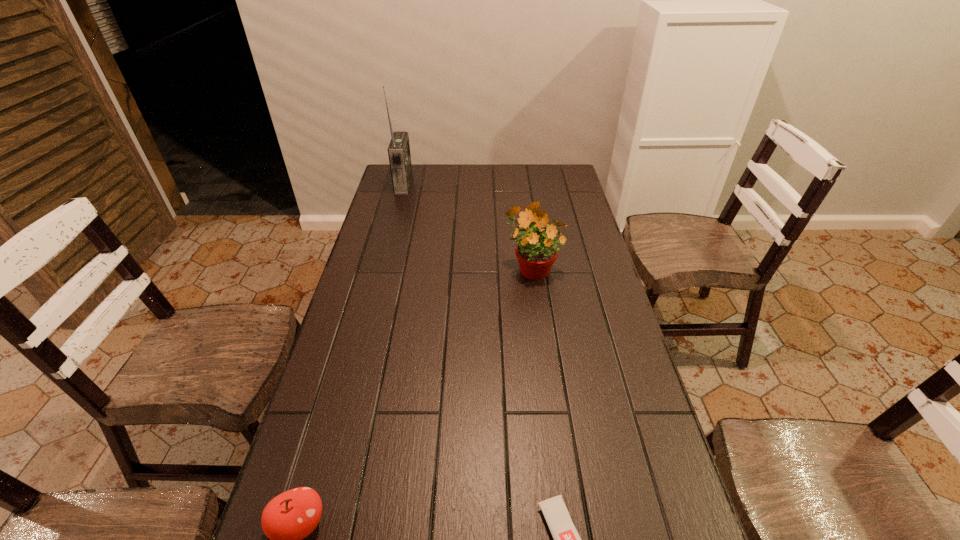
The height and width of the screenshot is (540, 960). I want to click on vacant region at the far edge of the desktop, so click(x=476, y=181).

The height and width of the screenshot is (540, 960). Identify the location of vacant space at the left edge of the desktop. (385, 272).

In the image, there is a desktop. Find the location of `vacant space at the right edge`. vacant space at the right edge is located at coordinates (638, 437).

Find the location of a particular element. The image size is (960, 540). vacant space at the far left corner is located at coordinates (423, 173).

The width and height of the screenshot is (960, 540). I want to click on vacant area that lies between the radio receiver and the third shortest object, so click(x=468, y=226).

Image resolution: width=960 pixels, height=540 pixels. What are the coordinates of `vacant point located between the flowerpot and the radio receiver` in the screenshot? It's located at (468, 226).

Identify which object is located as the third nearest to the radio receiver. Please provide its 2D coordinates. Your answer should be formatted as a tuple, i.e. [(x, y)], where the tuple contains the x and y coordinates of a point satisfying the conditions above.

[(566, 538)]

Locate an element on the screen. This screenshot has height=540, width=960. the second closest object to the third tallest object is located at coordinates (536, 253).

The width and height of the screenshot is (960, 540). In order to click on free space that satisfies the following two spatial constraints: 1. on the display of the third shortest object; 2. on the left side of the tallest object in this screenshot , I will do `click(382, 267)`.

At what (x,y) coordinates should I click in order to perform the action: click on vacant region that satisfies the following two spatial constraints: 1. on the display of the second farthest object; 2. on the left side of the tallest object. Please return your answer as a coordinate pair (x, y). Looking at the image, I should click on (382, 267).